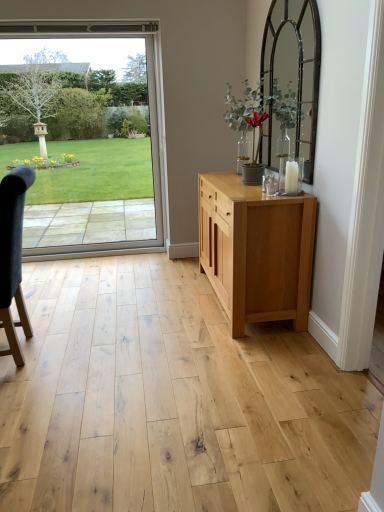
Where is `free spot to the right of dark gray fabric chair at left`? free spot to the right of dark gray fabric chair at left is located at coordinates (82, 355).